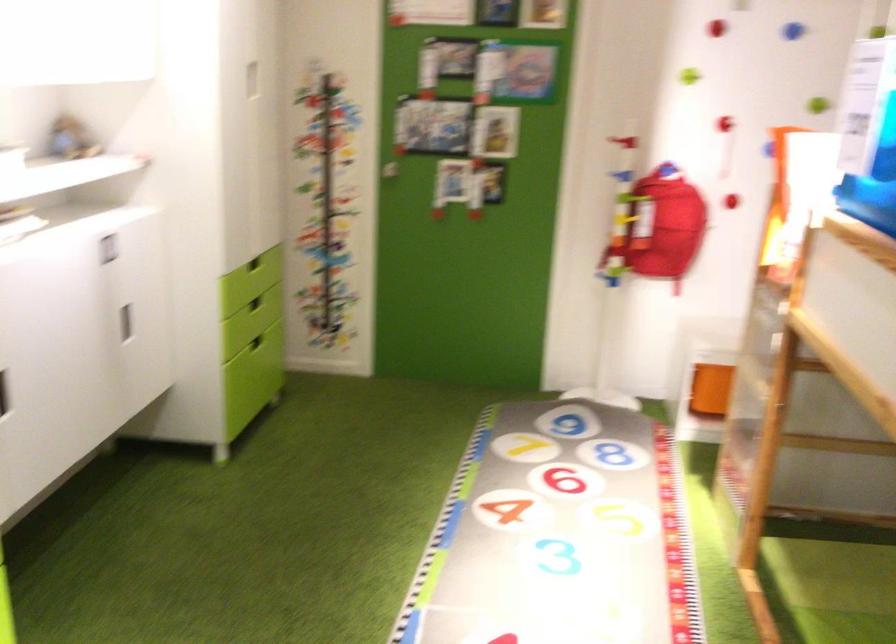
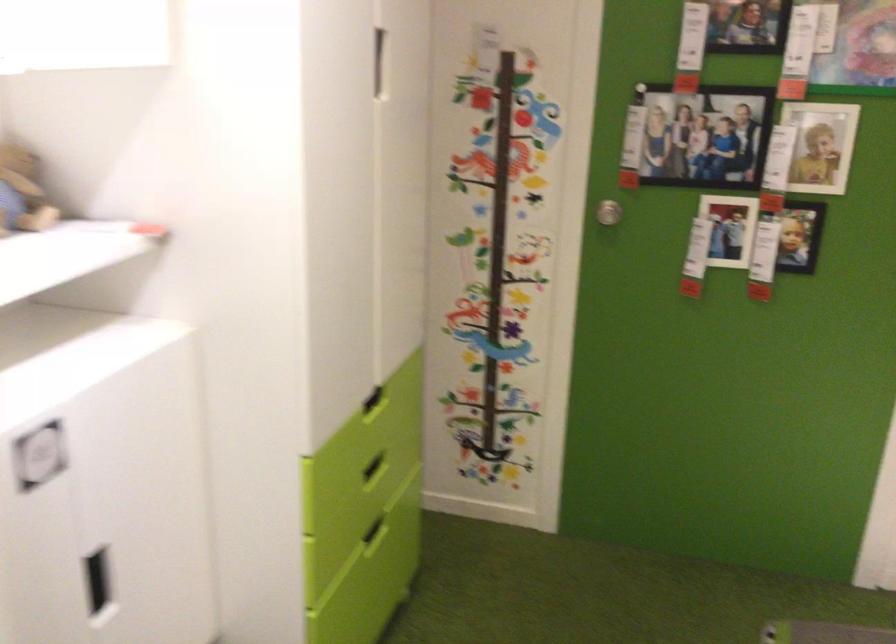
In the second image, find the point that corresponds to (x=255, y=299) in the first image.

(374, 468)